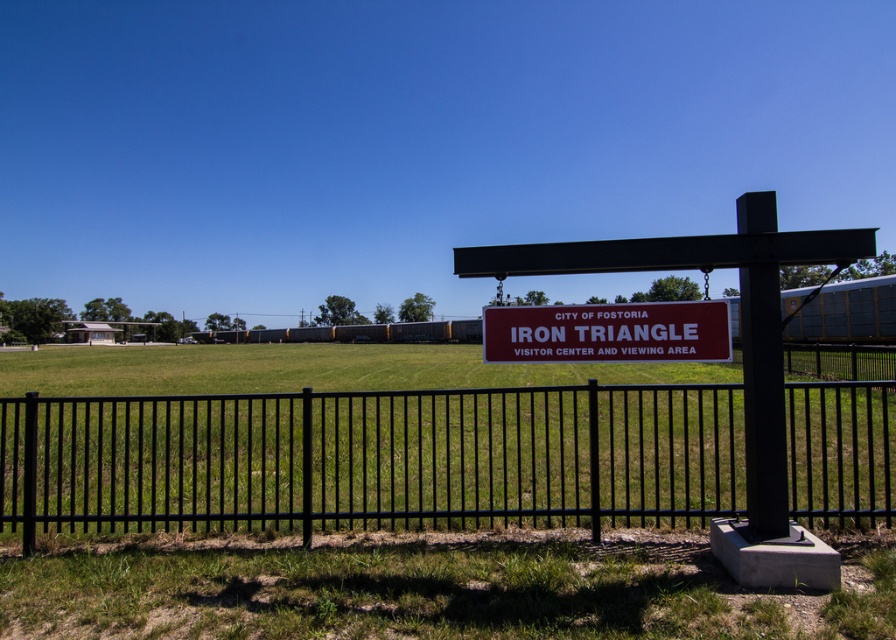
Question: Which point appears farthest from the camera in this image?

Choices:
 (A) (812, 324)
 (B) (563, 314)
 (C) (860, 326)

Answer: (A)

Question: Which object is the farthest from the yellow corrugated metal passenger train at center?

Choices:
 (A) yellow corrugated metal train at center
 (B) matte red sign at center
 (C) black metal fence at center

Answer: (A)

Question: Which of the following is the farthest from the observer?

Choices:
 (A) (42, 524)
 (B) (879, 284)

Answer: (B)

Question: Does black metal fence at center have a greater width compared to yellow corrugated metal train at center?

Choices:
 (A) yes
 (B) no

Answer: (B)

Question: In this image, where is black metal fence at center located relative to yellow corrugated metal passenger train at center?

Choices:
 (A) below
 (B) above

Answer: (A)

Question: Can you confirm if yellow corrugated metal train at center is positioned to the right of yellow corrugated metal passenger train at center?

Choices:
 (A) yes
 (B) no

Answer: (B)